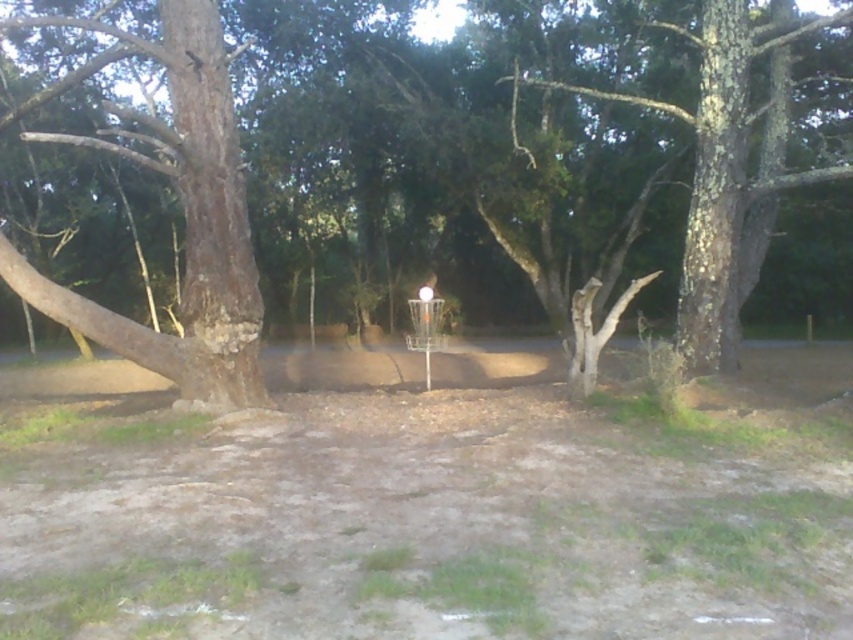
You are standing at the disc golf basket in the center of the image. You notice two rough bark trees nearby. Which of the two trees, the rough bark tree at left or the rough bark tree at center, has a narrower trunk?

The rough bark tree at left has a lesser width compared to the rough bark tree at center, so the rough bark tree at left has a narrower trunk.